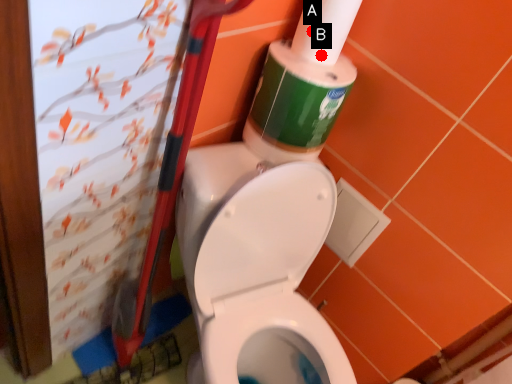
Question: Two points are circled on the image, labeled by A and B beside each circle. Which point is closer to the camera?

Choices:
 (A) A is closer
 (B) B is closer

Answer: (A)